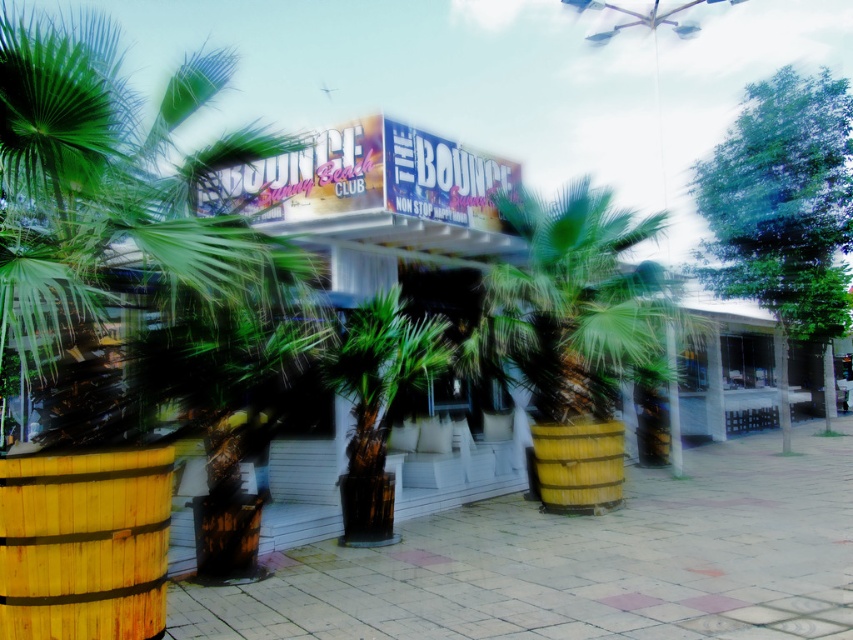
Find the location of a particular element. The image size is (853, 640). green wooden palm tree at center is located at coordinates (573, 333).

Is green wooden palm tree at center bigger than green textured palm tree at center?

Correct, green wooden palm tree at center is larger in size than green textured palm tree at center.

You are a GUI agent. You are given a task and a screenshot of the screen. Output one action in this format:
    pyautogui.click(x=<x>, y=<y>)
    Task: Click on the green wooden palm tree at center
    Image resolution: width=853 pixels, height=640 pixels.
    Given the screenshot: What is the action you would take?
    point(573,333)

Can you confirm if wooden barrel at lower left is thinner than wooden barrel at center?

Correct, wooden barrel at lower left's width is less than wooden barrel at center's.

Can you confirm if wooden barrel at lower left is positioned to the left of wooden barrel at center?

Correct, you'll find wooden barrel at lower left to the left of wooden barrel at center.

This screenshot has height=640, width=853. Identify the location of wooden barrel at lower left. (84, 545).

The height and width of the screenshot is (640, 853). Identify the location of wooden barrel at lower left. (84, 545).

Does green textured palm tree at center have a greater height compared to wooden barrel at center?

Yes.

Does green textured palm tree at center have a lesser width compared to wooden barrel at center?

In fact, green textured palm tree at center might be wider than wooden barrel at center.

Is point (412, 324) positioned after point (543, 442)?

No, (412, 324) is in front of (543, 442).

Identify the location of green textured palm tree at center. (379, 403).